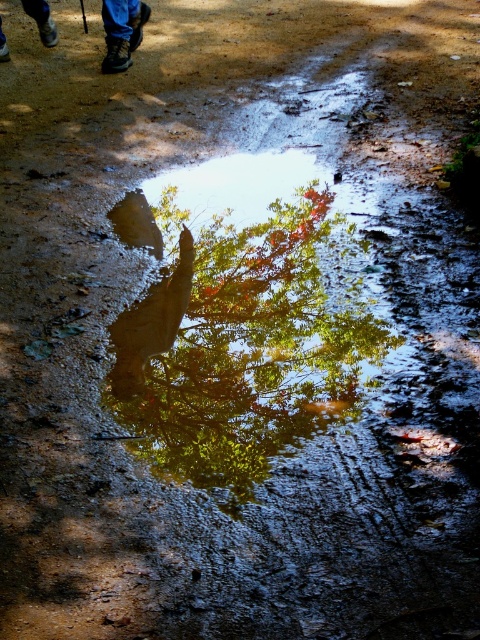
Based on the photo, you are standing on the dirt path and want to take a photo of the green glossy tree at center without the blue jeans at upper left appearing in the frame. Is this possible given their positions?

Yes, the green glossy tree at center is closer to the viewer than the blue jeans at upper left, so you can position yourself to frame the tree without the jeans obstructing the view.